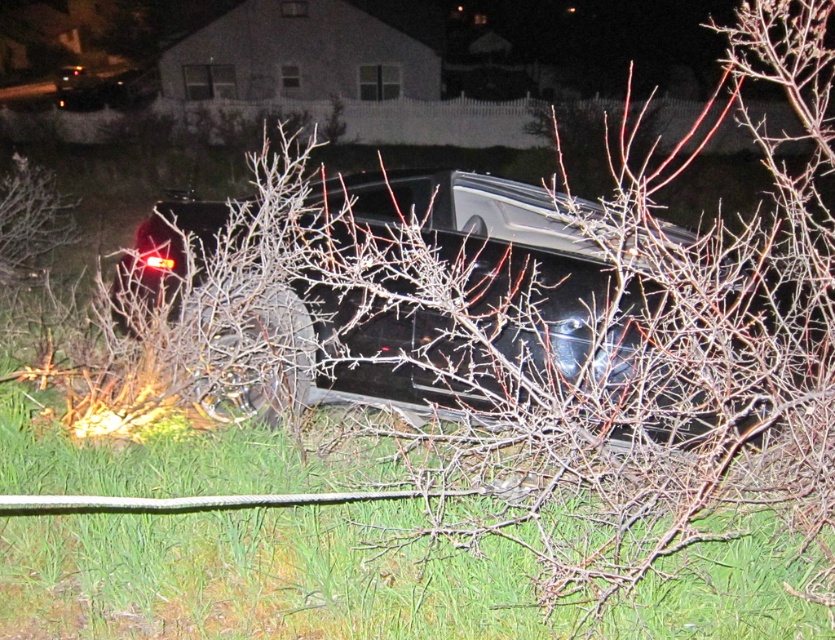
Between point (295, 573) and point (383, 298), which one is positioned in front?

Point (383, 298) is in front.

Is green grass at lower center positioned at the back of glossy black car at center?

No, it is in front of glossy black car at center.

Is point (317, 564) positioned in front of point (520, 236)?

That is True.

Locate an element on the screen. Image resolution: width=835 pixels, height=640 pixels. green grass at lower center is located at coordinates (262, 577).